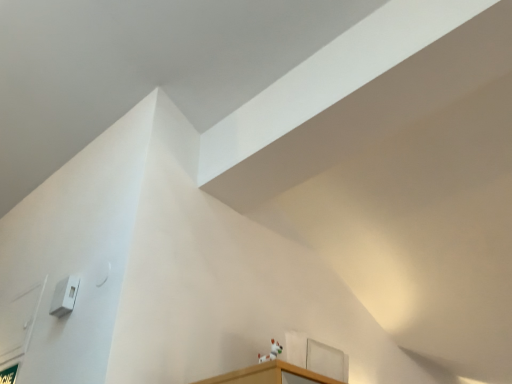
Describe the element at coordinates (64, 296) in the screenshot. I see `white plastic light switch at lower left` at that location.

The width and height of the screenshot is (512, 384). Find the location of `white plastic light switch at lower left`. white plastic light switch at lower left is located at coordinates (64, 296).

What is the approximate width of white plastic light switch at lower left?

1.87 inches.

The width and height of the screenshot is (512, 384). What are the coordinates of `white plastic light switch at lower left` in the screenshot? It's located at (64, 296).